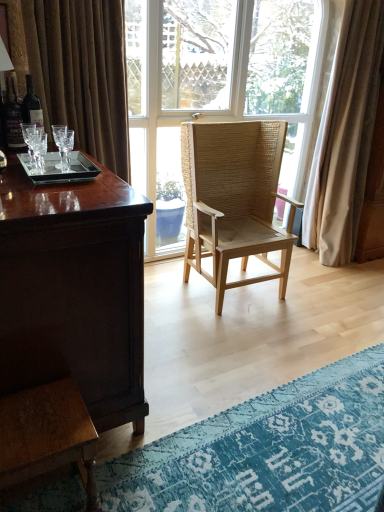
Question: Do you think beige fabric curtain at right is within shiny brown wood desk at left, or outside of it?

Choices:
 (A) outside
 (B) inside

Answer: (A)

Question: Does point (312, 243) appear closer or farther from the camera than point (39, 316)?

Choices:
 (A) farther
 (B) closer

Answer: (A)

Question: Estimate the real-world distances between objects in this image. Which object is closer to the clear glass tray at left?

Choices:
 (A) shiny brown wood desk at left
 (B) matte black bottle at left
 (C) blue textured rug at lower right
 (D) clear glass window at center
 (E) natural woven wood chair at center

Answer: (A)

Question: Estimate the real-world distances between objects in this image. Which object is farther from the beige fabric curtain at right?

Choices:
 (A) blue textured rug at lower right
 (B) shiny brown wood desk at left
 (C) natural woven wood chair at center
 (D) clear glass tray at left
 (E) dark glass bottle at left

Answer: (B)